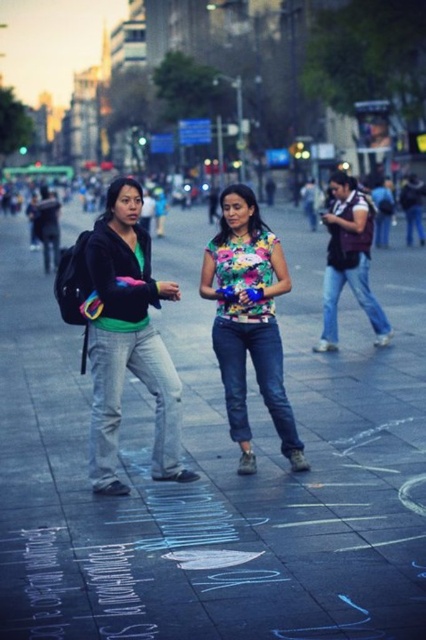
In the scene shown: You are standing in the plaza and want to take a photo of the floral fabric shirt at center without including the smooth concrete sidewalk at center in the background. Is this possible with your current camera angle?

The smooth concrete sidewalk at center is closer to the viewer than the floral fabric shirt at center, so adjusting the angle to exclude the sidewalk might be challenging. However, moving closer to the shirt or using a telephoto lens could help isolate the subject.

Consider the image. You are a photographer trying to capture both the matte black jacket at left and the floral fabric shirt at center in a single frame. Given their sizes in the image, which object should you focus on first to ensure both are in focus?

Since the matte black jacket at left occupies less space than the floral fabric shirt at center, you should focus on the floral fabric shirt at center first. This is because larger objects require more precise focusing to maintain sharpness across their entire area, ensuring both subjects are in focus.